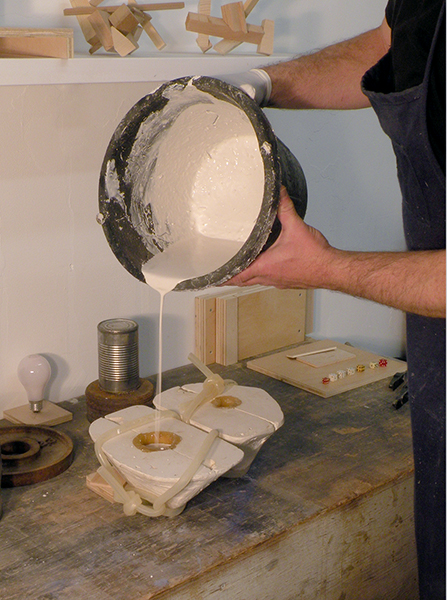
The width and height of the screenshot is (447, 600). Find the location of `bucket`. bucket is located at coordinates (289, 172).